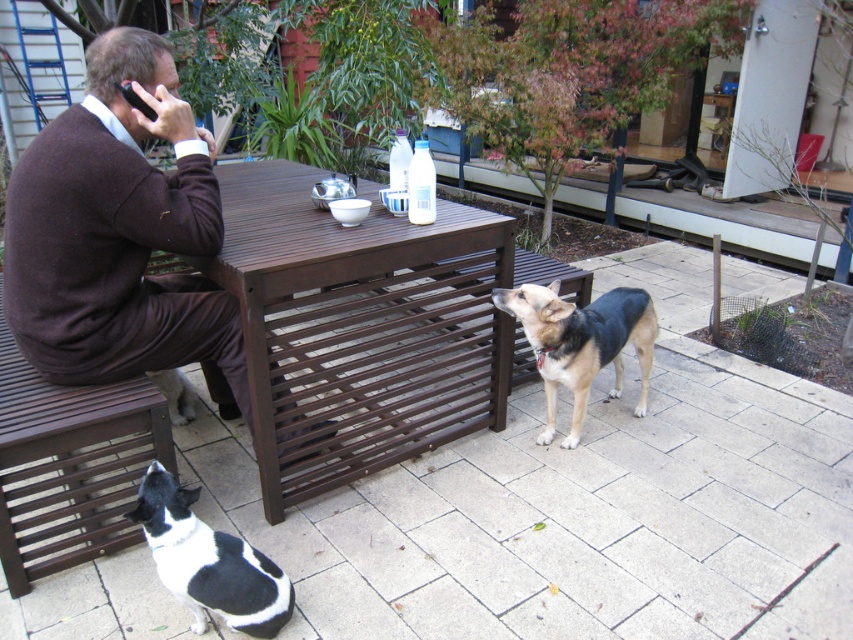
Which is below, brown wool sweater at left or tan and black fur dog at center?

tan and black fur dog at center

Is point (225, 333) behind point (553, 291)?

No.

I want to click on brown wool sweater at left, so click(x=120, y=236).

Between point (479, 214) and point (164, 444), which one is positioned in front?

Point (164, 444)

Is brown wooden table at center behind brown wooden bench at left?

That is True.

Locate an element on the screen. The image size is (853, 640). brown wooden table at center is located at coordinates (360, 324).

Based on the photo, which is more to the right, brown wooden table at center or black and white fur dog at lower left?

From the viewer's perspective, brown wooden table at center appears more on the right side.

Between point (309, 307) and point (293, 596), which one is positioned in front?

Point (293, 596)

Does point (381, 236) come closer to viewer compared to point (173, 552)?

No, it is behind (173, 552).

Find the location of a particular element. This screenshot has height=640, width=853. brown wooden table at center is located at coordinates (360, 324).